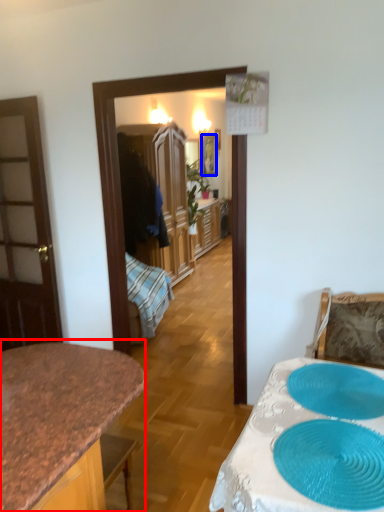
Question: Which point is further to the camera, countertop (highlighted by a red box) or picture frame (highlighted by a blue box)?

Choices:
 (A) countertop
 (B) picture frame

Answer: (B)